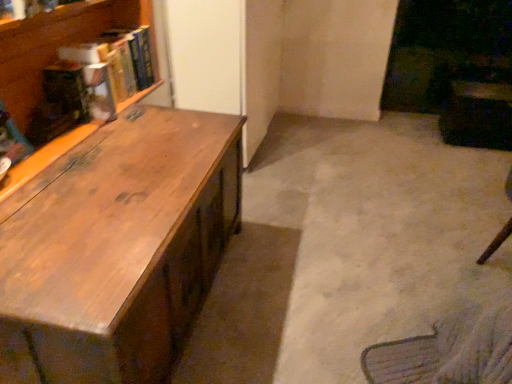
Question: From a real-world perspective, is hardcover book at upper left, which is the 2th book in back-to-front order, positioned over hardcover book at upper left, which is the first book in back-to-front order, based on gravity?

Choices:
 (A) no
 (B) yes

Answer: (A)

Question: Is hardcover book at upper left, the 1th book in the front-to-back sequence, completely or partially outside of hardcover book at upper left, which is the first book in back-to-front order?

Choices:
 (A) no
 (B) yes

Answer: (B)

Question: From a real-world perspective, is hardcover book at upper left, the 1th book in the front-to-back sequence, physically below hardcover book at upper left, which is the first book in back-to-front order?

Choices:
 (A) no
 (B) yes

Answer: (B)

Question: Is the depth of hardcover book at upper left, which is the 2th book in back-to-front order, less than that of hardcover book at upper left, which is the first book in back-to-front order?

Choices:
 (A) yes
 (B) no

Answer: (A)

Question: Is hardcover book at upper left, the 1th book in the front-to-back sequence, turned away from hardcover book at upper left, which is counted as the second book, starting from the front?

Choices:
 (A) yes
 (B) no

Answer: (B)

Question: Is hardcover book at upper left, which is the first book in back-to-front order, inside the boundaries of wooden desk at left, or outside?

Choices:
 (A) inside
 (B) outside

Answer: (B)

Question: From a real-world perspective, is hardcover book at upper left, which is the first book in back-to-front order, physically located above or below wooden desk at left?

Choices:
 (A) above
 (B) below

Answer: (A)

Question: In terms of height, does hardcover book at upper left, which is the first book in back-to-front order, look taller or shorter compared to wooden desk at left?

Choices:
 (A) tall
 (B) short

Answer: (B)

Question: Is point (130, 74) positioned closer to the camera than point (74, 362)?

Choices:
 (A) farther
 (B) closer

Answer: (A)

Question: Looking at their shapes, would you say wooden desk at left is wider or thinner than hardcover book at upper left, which is counted as the second book, starting from the front?

Choices:
 (A) wide
 (B) thin

Answer: (A)

Question: Is wooden desk at left taller or shorter than hardcover book at upper left, which is counted as the second book, starting from the front?

Choices:
 (A) tall
 (B) short

Answer: (A)

Question: Looking at the image, does wooden desk at left seem bigger or smaller compared to hardcover book at upper left, which is counted as the second book, starting from the front?

Choices:
 (A) small
 (B) big

Answer: (B)

Question: Is wooden desk at left inside the boundaries of hardcover book at upper left, which is counted as the second book, starting from the front, or outside?

Choices:
 (A) outside
 (B) inside

Answer: (A)

Question: Considering the positions of point (99, 112) and point (144, 79), is point (99, 112) closer or farther from the camera than point (144, 79)?

Choices:
 (A) closer
 (B) farther

Answer: (A)

Question: From a real-world perspective, relative to hardcover book at upper left, which is counted as the second book, starting from the front, is hardcover book at upper left, the 1th book in the front-to-back sequence, vertically above or below?

Choices:
 (A) above
 (B) below

Answer: (B)